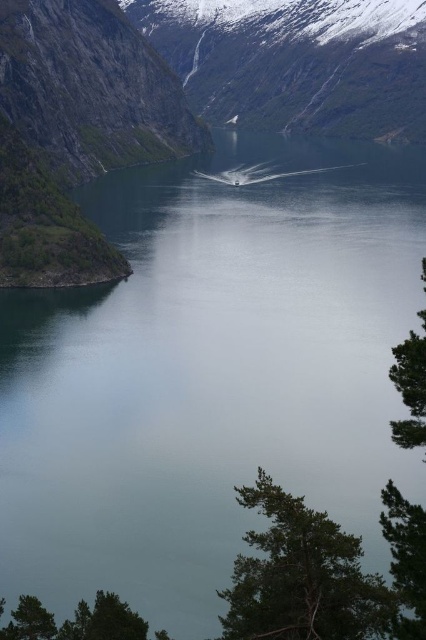
Question: Among these objects, which one is nearest to the camera?

Choices:
 (A) green textured tree at lower right
 (B) green textured tree at right

Answer: (A)

Question: Is green textured tree at lower right in front of green textured tree at right?

Choices:
 (A) no
 (B) yes

Answer: (B)

Question: Is green textured tree at lower right above green textured tree at right?

Choices:
 (A) yes
 (B) no

Answer: (B)

Question: Does green textured tree at lower right appear over green textured tree at right?

Choices:
 (A) no
 (B) yes

Answer: (A)

Question: Which point is closer to the camera?

Choices:
 (A) green textured tree at lower right
 (B) green textured tree at right

Answer: (A)